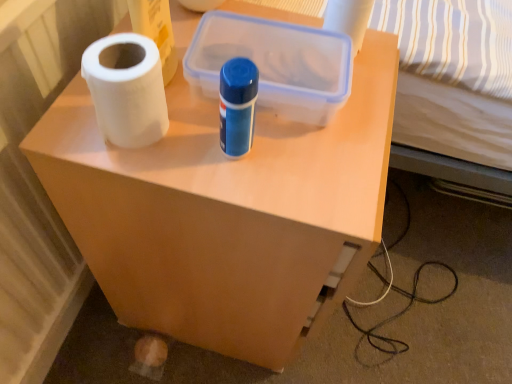
Locate an element on the screen. This screenshot has height=384, width=512. free location to the right of white matte paper towel at left is located at coordinates (267, 164).